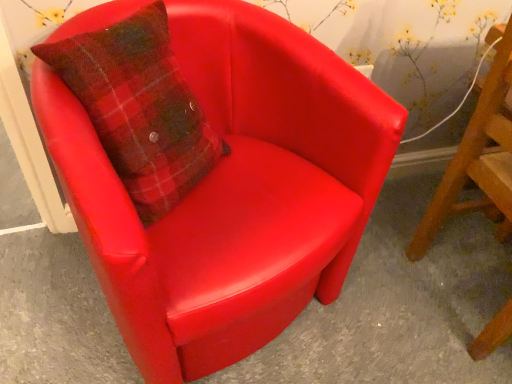
This screenshot has height=384, width=512. Describe the element at coordinates (232, 191) in the screenshot. I see `matte red armchair at center, which is the 1th chair in left-to-right order` at that location.

Identify the location of matte red chair at center, acting as the second chair starting from the left. The height and width of the screenshot is (384, 512). (479, 157).

In terms of size, does matte red chair at center, arranged as the 1th chair when viewed from the right, appear bigger or smaller than glossy leather chair at center?

In the image, matte red chair at center, arranged as the 1th chair when viewed from the right, appears to be larger than glossy leather chair at center.

Is matte red chair at center, arranged as the 1th chair when viewed from the right, positioned with its back to glossy leather chair at center?

Yes, matte red chair at center, arranged as the 1th chair when viewed from the right, is facing away from glossy leather chair at center.

At what (x,y) coordinates should I click in order to perform the action: click on concrete below the matte red chair at center, acting as the second chair starting from the left (from the image's perspective). Please return your answer as a coordinate pair (x, y). Looking at the image, I should click on (399, 305).

From a real-world perspective, is matte red chair at center, acting as the second chair starting from the left, above or below glossy leather chair at center?

Clearly, from a real-world perspective, matte red chair at center, acting as the second chair starting from the left, is above glossy leather chair at center.

Which of these two, matte red chair at center, acting as the second chair starting from the left, or matte red armchair at center, which is the 1th chair in left-to-right order, is bigger?

matte red armchair at center, which is the 1th chair in left-to-right order, is bigger.

Between matte red chair at center, acting as the second chair starting from the left, and matte red armchair at center, which is the 1th chair in left-to-right order, which one has more height?

Standing taller between the two is matte red chair at center, acting as the second chair starting from the left.

Which is more to the right, matte red chair at center, acting as the second chair starting from the left, or matte red armchair at center, which is the 1th chair in left-to-right order?

From the viewer's perspective, matte red chair at center, acting as the second chair starting from the left, appears more on the right side.

Is matte red armchair at center, which is the 1th chair in left-to-right order, with glossy leather chair at center?

No, matte red armchair at center, which is the 1th chair in left-to-right order, is not in contact with glossy leather chair at center.

Is matte red armchair at center, which is the 1th chair in left-to-right order, to the left or to the right of glossy leather chair at center in the image?

matte red armchair at center, which is the 1th chair in left-to-right order, is positioned on glossy leather chair at center's left side.

This screenshot has width=512, height=384. Identify the location of concrete located behind the matte red armchair at center, which is the 1th chair in left-to-right order. (399, 305).

From a real-world perspective, is glossy leather chair at center physically below matte red chair at center, acting as the second chair starting from the left?

Indeed, from a real-world perspective, glossy leather chair at center is positioned beneath matte red chair at center, acting as the second chair starting from the left.

Can you confirm if glossy leather chair at center is positioned to the right of matte red chair at center, arranged as the 1th chair when viewed from the right?

In fact, glossy leather chair at center is to the left of matte red chair at center, arranged as the 1th chair when viewed from the right.

Is glossy leather chair at center wider than matte red chair at center, arranged as the 1th chair when viewed from the right?

Indeed, glossy leather chair at center has a greater width compared to matte red chair at center, arranged as the 1th chair when viewed from the right.

Considering the positions of objects glossy leather chair at center and matte red chair at center, acting as the second chair starting from the left, in the image provided, who is behind, glossy leather chair at center or matte red chair at center, acting as the second chair starting from the left,?

glossy leather chair at center.

From a real-world perspective, is glossy leather chair at center positioned above or below matte red armchair at center, which is the 1th chair in left-to-right order?

glossy leather chair at center is situated lower than matte red armchair at center, which is the 1th chair in left-to-right order, in the real world.

In the scene shown: Is glossy leather chair at center positioned far away from matte red armchair at center, which is the 1th chair in left-to-right order?

No, glossy leather chair at center is not far away from matte red armchair at center, which is the 1th chair in left-to-right order.

Is glossy leather chair at center oriented towards matte red armchair at center, which is the 1th chair in left-to-right order?

No.

Can you confirm if matte red armchair at center, which is the second chair in right-to-left order, is taller than matte red chair at center, arranged as the 1th chair when viewed from the right?

No.

Is matte red armchair at center, which is the second chair in right-to-left order, not close to matte red chair at center, acting as the second chair starting from the left?

matte red armchair at center, which is the second chair in right-to-left order, is near matte red chair at center, acting as the second chair starting from the left, not far away.

How many degrees apart are the facing directions of matte red armchair at center, which is the 1th chair in left-to-right order, and matte red chair at center, arranged as the 1th chair when viewed from the right?

67.8 degrees separate the facing orientations of matte red armchair at center, which is the 1th chair in left-to-right order, and matte red chair at center, arranged as the 1th chair when viewed from the right.

Locate an element on the screen. The image size is (512, 384). the 2nd chair above the glossy leather chair at center (from a real-world perspective) is located at coordinates (479, 157).

Where is `chair on the left of matte red chair at center, arranged as the 1th chair when viewed from the right`? chair on the left of matte red chair at center, arranged as the 1th chair when viewed from the right is located at coordinates (232, 191).

When comparing their distances from matte red armchair at center, which is the 1th chair in left-to-right order, does matte red chair at center, acting as the second chair starting from the left, or glossy leather chair at center seem closer?

Based on the image, glossy leather chair at center appears to be nearer to matte red armchair at center, which is the 1th chair in left-to-right order.

Which object lies nearer to the anchor point matte red armchair at center, which is the 1th chair in left-to-right order, glossy leather chair at center or matte red chair at center, acting as the second chair starting from the left?

Based on the image, glossy leather chair at center appears to be nearer to matte red armchair at center, which is the 1th chair in left-to-right order.

Which object lies further to the anchor point glossy leather chair at center, matte red armchair at center, which is the 1th chair in left-to-right order, or matte red chair at center, arranged as the 1th chair when viewed from the right?

Among the two, matte red armchair at center, which is the 1th chair in left-to-right order, is located further to glossy leather chair at center.

Estimate the real-world distances between objects in this image. Which object is further from matte red chair at center, acting as the second chair starting from the left, matte red armchair at center, which is the second chair in right-to-left order, or glossy leather chair at center?

matte red armchair at center, which is the second chair in right-to-left order, is positioned further to the anchor matte red chair at center, acting as the second chair starting from the left.

When comparing their distances from glossy leather chair at center, does matte red chair at center, arranged as the 1th chair when viewed from the right, or matte red armchair at center, which is the second chair in right-to-left order, seem closer?

The object closer to glossy leather chair at center is matte red chair at center, arranged as the 1th chair when viewed from the right.

Estimate the real-world distances between objects in this image. Which object is closer to matte red chair at center, acting as the second chair starting from the left, glossy leather chair at center or matte red armchair at center, which is the 1th chair in left-to-right order?

glossy leather chair at center lies closer to matte red chair at center, acting as the second chair starting from the left, than the other object.

Where is `concrete between matte red armchair at center, which is the second chair in right-to-left order, and matte red chair at center, acting as the second chair starting from the left, from left to right`? Image resolution: width=512 pixels, height=384 pixels. concrete between matte red armchair at center, which is the second chair in right-to-left order, and matte red chair at center, acting as the second chair starting from the left, from left to right is located at coordinates 399,305.